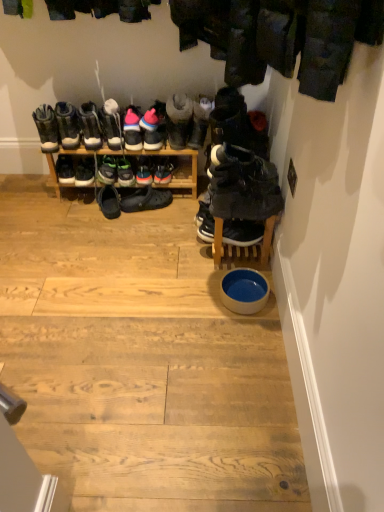
Locate an element on the screen. vacant area on top of blue ceramic bowl at center (from a real-world perspective) is located at coordinates (249, 285).